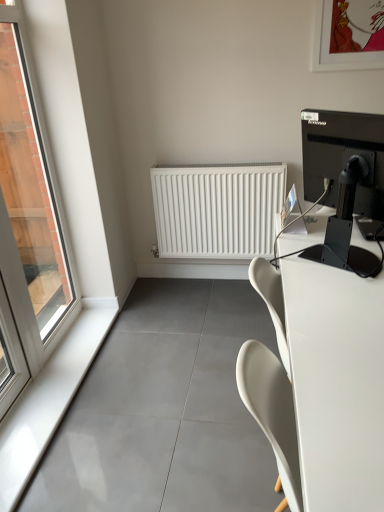
Question: From the image's perspective, would you say clear glass window at left is positioned over white glossy window sill at left?

Choices:
 (A) no
 (B) yes

Answer: (B)

Question: Considering the relative positions of clear glass window at left and white glossy window sill at left in the image provided, is clear glass window at left in front of white glossy window sill at left?

Choices:
 (A) yes
 (B) no

Answer: (A)

Question: Does clear glass window at left have a lesser height compared to white glossy window sill at left?

Choices:
 (A) no
 (B) yes

Answer: (A)

Question: Considering the relative sizes of clear glass window at left and white glossy window sill at left in the image provided, is clear glass window at left thinner than white glossy window sill at left?

Choices:
 (A) no
 (B) yes

Answer: (B)

Question: Is clear glass window at left outside white glossy window sill at left?

Choices:
 (A) no
 (B) yes

Answer: (B)

Question: Can you confirm if clear glass window at left is wider than white glossy window sill at left?

Choices:
 (A) no
 (B) yes

Answer: (A)

Question: Considering the relative positions of white glossy desk at right and white glossy window sill at left in the image provided, is white glossy desk at right behind white glossy window sill at left?

Choices:
 (A) no
 (B) yes

Answer: (A)

Question: Can you confirm if white glossy desk at right is shorter than white glossy window sill at left?

Choices:
 (A) no
 (B) yes

Answer: (A)

Question: Are white glossy desk at right and white glossy window sill at left far apart?

Choices:
 (A) no
 (B) yes

Answer: (B)

Question: Can you confirm if white glossy desk at right is taller than white glossy window sill at left?

Choices:
 (A) no
 (B) yes

Answer: (B)

Question: Does white glossy desk at right turn towards white glossy window sill at left?

Choices:
 (A) no
 (B) yes

Answer: (A)

Question: From the image's perspective, is white glossy desk at right located above white glossy window sill at left?

Choices:
 (A) yes
 (B) no

Answer: (A)

Question: Considering the relative sizes of white glossy window sill at left and clear glass window at left in the image provided, is white glossy window sill at left taller than clear glass window at left?

Choices:
 (A) no
 (B) yes

Answer: (A)